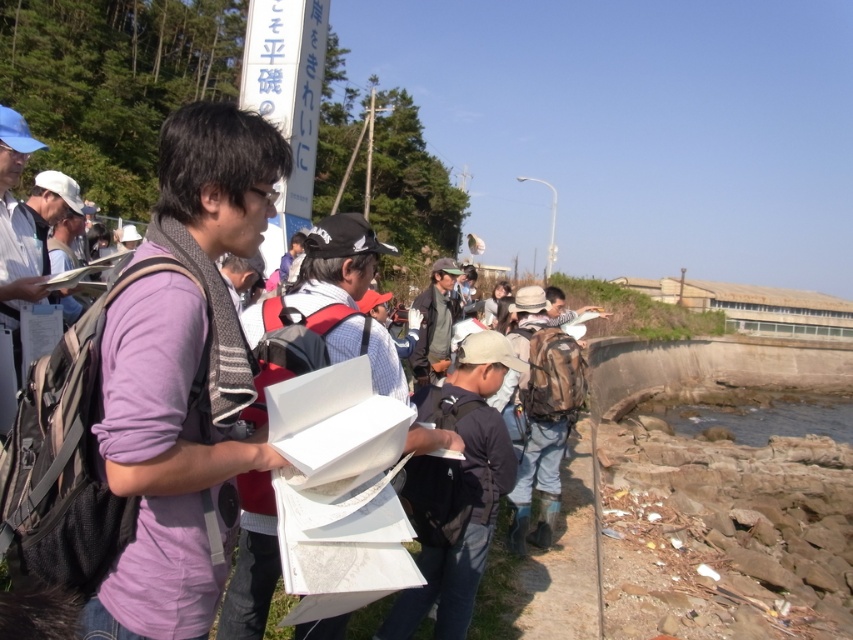
Question: Based on their relative distances, which object is farther from the clear water at lower right?

Choices:
 (A) purple matte shirt at center
 (B) dark green jacket at center

Answer: (A)

Question: Can you confirm if clear water at lower right is positioned to the left of dark green jacket at center?

Choices:
 (A) yes
 (B) no

Answer: (B)

Question: Among these objects, which one is nearest to the camera?

Choices:
 (A) purple matte shirt at center
 (B) clear water at lower right

Answer: (A)

Question: Is purple matte shirt at center smaller than clear water at lower right?

Choices:
 (A) yes
 (B) no

Answer: (A)

Question: Which point is farther from the camera taking this photo?

Choices:
 (A) (849, 444)
 (B) (241, 333)
 (C) (450, 304)

Answer: (A)

Question: Observing the image, what is the correct spatial positioning of purple matte shirt at center in reference to dark green jacket at center?

Choices:
 (A) above
 (B) below

Answer: (B)